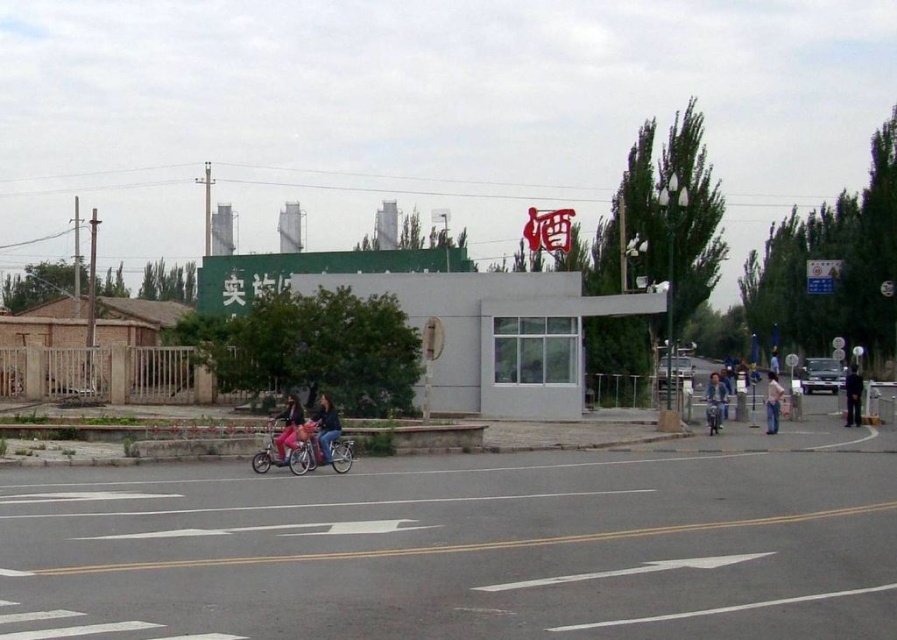
Does pink fabric pants at center have a greater height compared to dark blue uniform at center?

No.

Is point (298, 422) closer to viewer compared to point (859, 412)?

That is True.

Find the location of a particular element. pink fabric pants at center is located at coordinates click(288, 426).

Between pink matte bicycle at center and denim jacket at center, which one has less height?

pink matte bicycle at center is shorter.

Between pink matte bicycle at center and denim jacket at center, which one is positioned lower?

pink matte bicycle at center is below.

Which is behind, point (302, 448) or point (321, 422)?

The point (321, 422) is more distant.

Locate an element on the screen. The height and width of the screenshot is (640, 897). pink matte bicycle at center is located at coordinates (282, 445).

Is point (858, 404) farther from camera compared to point (774, 406)?

Yes.

Can you confirm if dark blue uniform at center is shorter than light blue jeans at lower right?

No.

Is point (850, 369) farther from camera compared to point (765, 406)?

Yes, it is behind point (765, 406).

Find the location of a particular element. This screenshot has height=640, width=897. dark blue uniform at center is located at coordinates (852, 396).